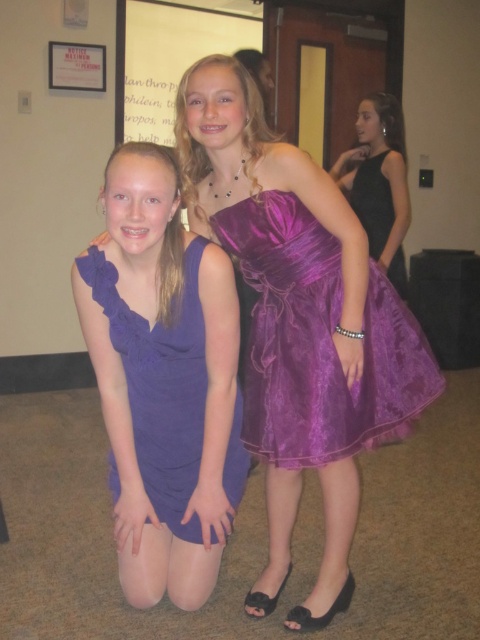
Between velvet purple dress at upper center and matte purple dress at lower left, which one appears on the right side from the viewer's perspective?

velvet purple dress at upper center

Is velvet purple dress at upper center above matte purple dress at lower left?

Correct, velvet purple dress at upper center is located above matte purple dress at lower left.

Is point (328, 392) farther from viewer compared to point (143, 413)?

No, (328, 392) is closer to viewer.

The width and height of the screenshot is (480, 640). I want to click on velvet purple dress at upper center, so click(317, 340).

Does velvet purple dress at upper center appear on the left side of matte white paper at upper center?

In fact, velvet purple dress at upper center is to the right of matte white paper at upper center.

Is velvet purple dress at upper center smaller than matte white paper at upper center?

Indeed, velvet purple dress at upper center has a smaller size compared to matte white paper at upper center.

Locate an element on the screen. velvet purple dress at upper center is located at coordinates (317, 340).

Which is below, velvet purple dress at upper center or black satin dress at right?

Positioned lower is velvet purple dress at upper center.

Which is in front, point (298, 292) or point (367, 170)?

Positioned in front is point (298, 292).

Based on the photo, who is more forward, (x=383, y=440) or (x=367, y=192)?

Point (x=383, y=440) is in front.

Where is `velvet purple dress at upper center`? The height and width of the screenshot is (640, 480). velvet purple dress at upper center is located at coordinates (317, 340).